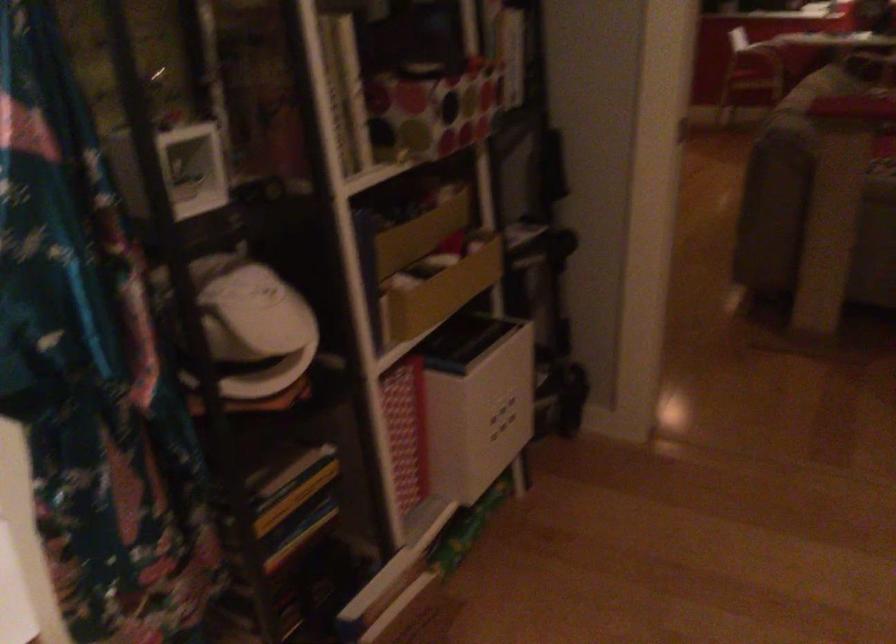
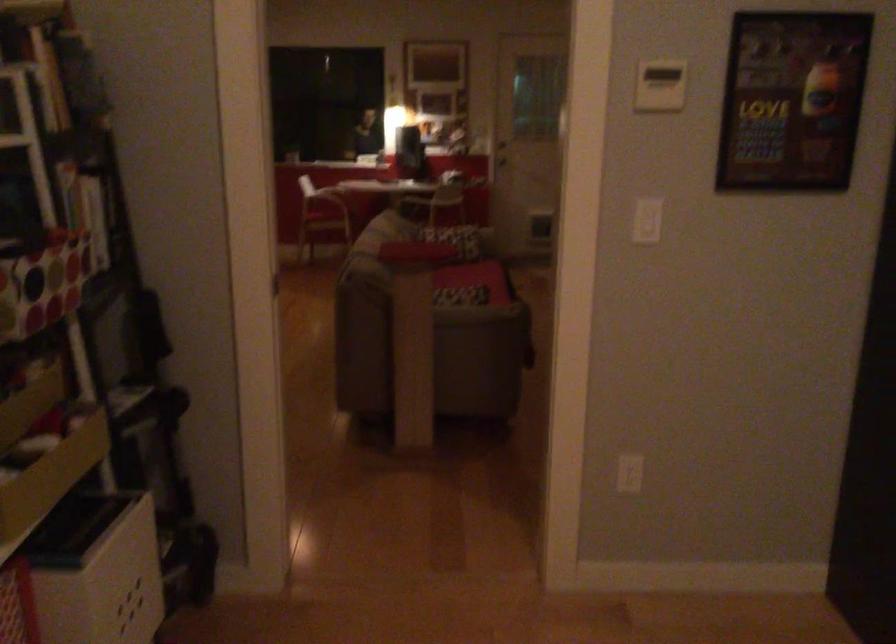
In a continuous first-person perspective shot, in which direction is the camera moving?

The movement direction of the cameraman is left, backward.